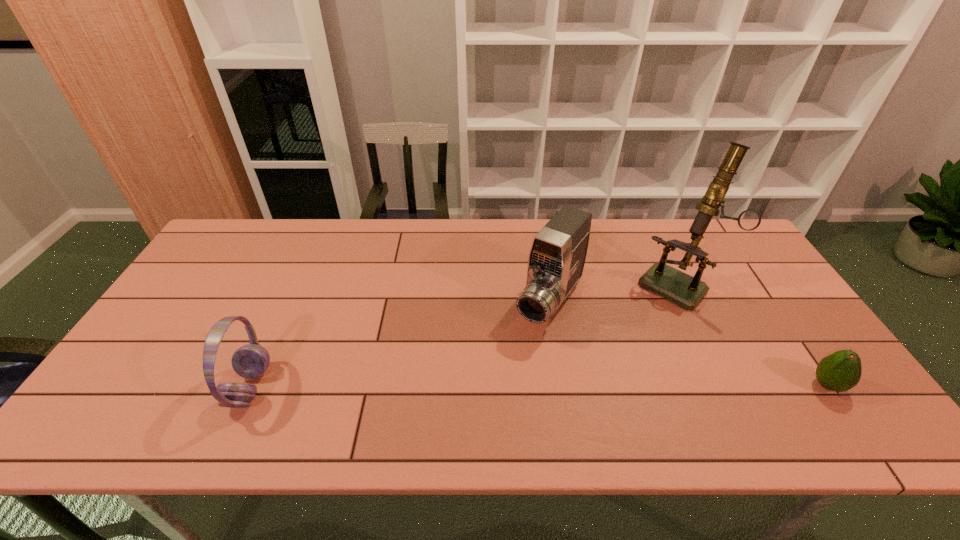
You are a GUI agent. You are given a task and a screenshot of the screen. Output one action in this format:
    pyautogui.click(x=<x>, y=<y>)
    Task: Click on the unoccupied position between the headset and the tallest object
    The height and width of the screenshot is (540, 960).
    Given the screenshot: What is the action you would take?
    pyautogui.click(x=463, y=336)

I want to click on free space that is in between the second tallest object and the tallest object, so click(612, 294).

Locate an element on the screen. The image size is (960, 540). free space that is in between the second object from left to right and the tallest object is located at coordinates (612, 294).

Where is `free space between the second tallest object and the tallest object`? The width and height of the screenshot is (960, 540). free space between the second tallest object and the tallest object is located at coordinates (612, 294).

Identify the location of free space between the leftmost object and the tallest object. This screenshot has width=960, height=540. (463, 336).

Find the location of a particular element. This screenshot has width=960, height=540. free space between the shortest object and the third shortest object is located at coordinates (688, 345).

Where is `vacant area between the camcorder and the second object from right to left`? vacant area between the camcorder and the second object from right to left is located at coordinates (612, 294).

Where is `object that stands as the closest to the rightmost object`? object that stands as the closest to the rightmost object is located at coordinates (686, 291).

The height and width of the screenshot is (540, 960). What are the coordinates of `object that ranks as the closest to the leftmost object` in the screenshot? It's located at (558, 252).

At what (x,y) coordinates should I click in order to perform the action: click on free region that satisfies the following two spatial constraints: 1. on the back side of the camcorder; 2. on the left side of the tallest object. Please return your answer as a coordinate pair (x, y). Image resolution: width=960 pixels, height=540 pixels. Looking at the image, I should click on (547, 285).